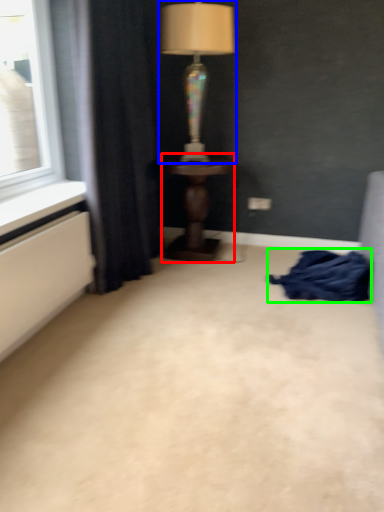
Question: Which object is the farthest from table (highlighted by a red box)? Choose among these: lamp (highlighted by a blue box) or blanket (highlighted by a green box).

Choices:
 (A) lamp
 (B) blanket

Answer: (A)